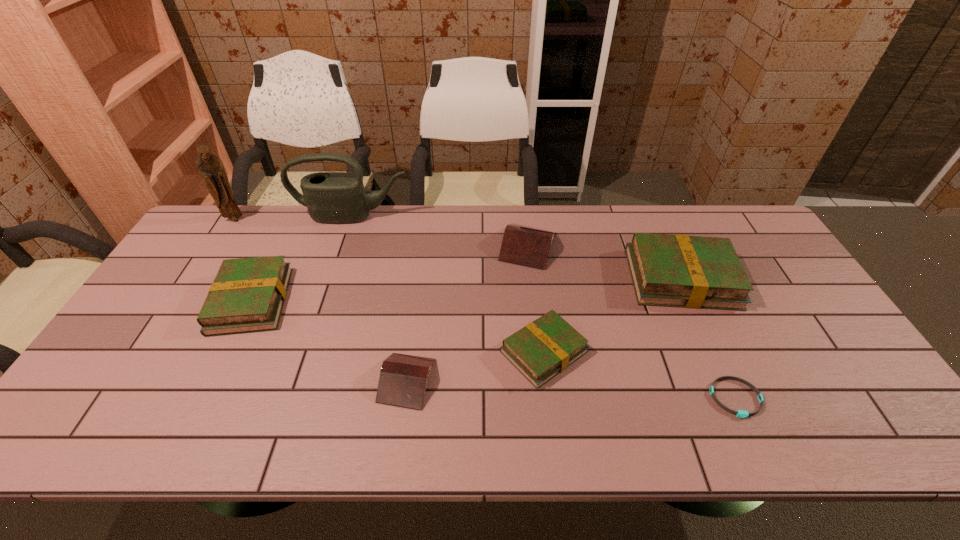
Locate an element on the screen. the nearer brown book is located at coordinates (403, 378).

Image resolution: width=960 pixels, height=540 pixels. I want to click on the smaller brown book, so click(403, 378).

Identify the location of the second yellow book from left to right. (544, 348).

Where is `gray wristband`? gray wristband is located at coordinates (743, 414).

Locate an element on the screen. This screenshot has height=540, width=960. wristband is located at coordinates (743, 414).

Where is `free space located 0.070m on the front-facing side of the leftmost object`? The width and height of the screenshot is (960, 540). free space located 0.070m on the front-facing side of the leftmost object is located at coordinates (225, 237).

I want to click on free space located 0.070m on the spout of the watering can, so click(x=346, y=238).

Locate an element on the screen. The width and height of the screenshot is (960, 540). vacant space located 0.210m on the left of the rightmost yellow book is located at coordinates (559, 279).

You are a GUI agent. You are given a task and a screenshot of the screen. Output one action in this format:
    pyautogui.click(x=<x>, y=<y>)
    Task: Click on the vacant space situated on the left of the bigger brown book
    
    Given the screenshot: What is the action you would take?
    pyautogui.click(x=461, y=246)

Locate an element on the screen. This screenshot has height=540, width=960. vacant space positioned on the back of the second smallest yellow book is located at coordinates (292, 218).